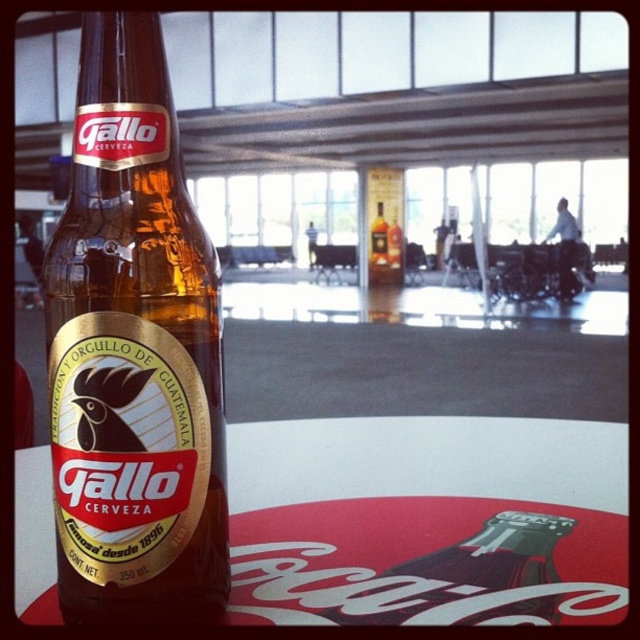
Who is higher up, white glossy table at center or glass coca-cola bottle at center?

white glossy table at center is higher up.

Between point (433, 528) and point (509, 548), which one is positioned behind?

The point (433, 528) is more distant.

At what (x,y) coordinates should I click in order to perform the action: click on white glossy table at center. Please return your answer as a coordinate pair (x, y). This screenshot has height=640, width=640. Looking at the image, I should click on (428, 522).

Does glass coca-cola bottle at center appear over matte glass bottle at center?

No.

Can you confirm if glass coca-cola bottle at center is bigger than matte glass bottle at center?

Yes, glass coca-cola bottle at center is bigger than matte glass bottle at center.

Who is more distant from viewer, (464, 564) or (374, 224)?

The point (374, 224) is behind.

Find the location of a particular element. The height and width of the screenshot is (640, 640). glass coca-cola bottle at center is located at coordinates (461, 570).

Consider the image. Is brown glass bottle at center shorter than white glossy table at center?

No.

Is point (109, 221) less distant than point (624, 566)?

Yes.

Where is `brown glass bottle at center`? This screenshot has width=640, height=640. brown glass bottle at center is located at coordinates (132, 349).